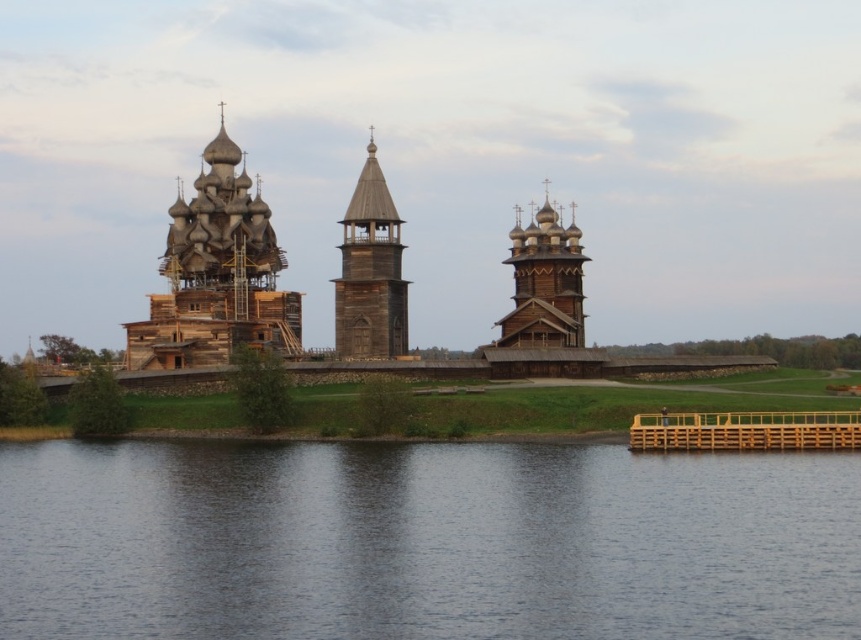
Does dark blue water at lower center have a smaller size compared to brown wooden tower at center?

Actually, dark blue water at lower center might be larger than brown wooden tower at center.

Which of these two, dark blue water at lower center or brown wooden tower at center, stands shorter?

Standing shorter between the two is dark blue water at lower center.

The width and height of the screenshot is (861, 640). I want to click on dark blue water at lower center, so click(424, 541).

Image resolution: width=861 pixels, height=640 pixels. Find the location of `brown wooden tower at center`. brown wooden tower at center is located at coordinates (370, 272).

Between brown wooden tower at center and wooden tower at center, which one has more height?

brown wooden tower at center is taller.

Image resolution: width=861 pixels, height=640 pixels. I want to click on brown wooden tower at center, so 370,272.

Who is lower down, dark blue water at lower center or wooden church at left?

Positioned lower is dark blue water at lower center.

Is dark blue water at lower center further to the viewer compared to wooden church at left?

No, dark blue water at lower center is closer to the viewer.

Is point (432, 573) positioned before point (193, 344)?

Yes, it is in front of point (193, 344).

You are a GUI agent. You are given a task and a screenshot of the screen. Output one action in this format:
    pyautogui.click(x=<x>, y=<y>)
    Task: Click on the dark blue water at lower center
    This screenshot has height=640, width=861.
    Given the screenshot: What is the action you would take?
    pyautogui.click(x=424, y=541)